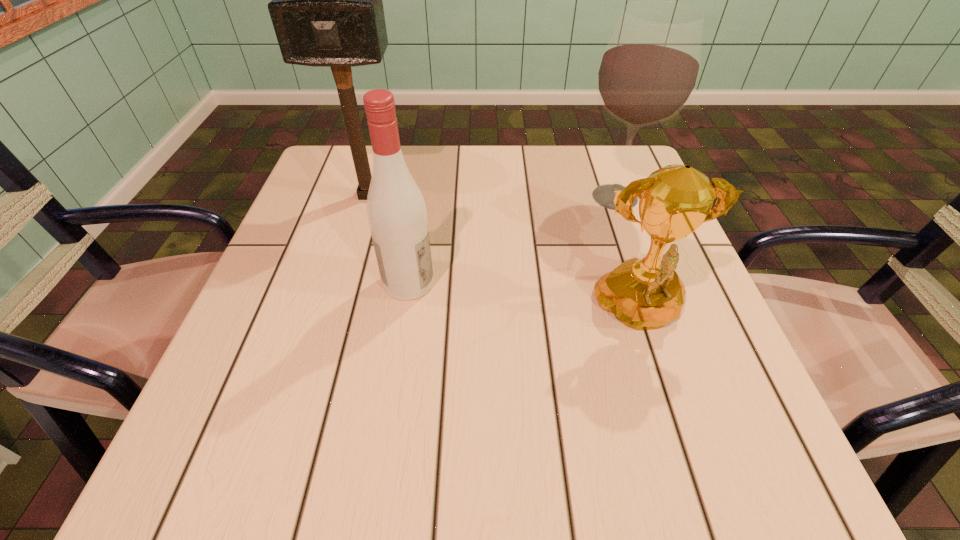
Find the location of a particular element. free space at the near left corner of the desktop is located at coordinates (225, 489).

You are a GUI agent. You are given a task and a screenshot of the screen. Output one action in this format:
    pyautogui.click(x=<x>, y=<y>)
    Task: Click on the blank space at the far right corner of the desktop
    
    Given the screenshot: What is the action you would take?
    pyautogui.click(x=597, y=153)

Identify the location of free spot between the shortest object and the left alcohol. (524, 299).

Identify the location of free space between the left alcohol and the shortest object. (524, 299).

Locate an element on the screen. Image resolution: width=960 pixels, height=540 pixels. free space between the shortest object and the farther alcohol is located at coordinates (628, 256).

You are a GUI agent. You are given a task and a screenshot of the screen. Output one action in this format:
    pyautogui.click(x=<x>, y=<y>)
    Task: Click on the free space between the right alcohol and the left alcohol
    
    Given the screenshot: What is the action you would take?
    pyautogui.click(x=512, y=240)

The height and width of the screenshot is (540, 960). I want to click on vacant area between the left alcohol and the right alcohol, so coord(512,240).

Locate an element on the screen. The image size is (960, 540). vacant area between the nearer alcohol and the farther alcohol is located at coordinates (512, 240).

The height and width of the screenshot is (540, 960). I want to click on vacant space in between the mallet and the award, so click(x=504, y=255).

This screenshot has height=540, width=960. I want to click on free space between the right alcohol and the mallet, so click(492, 196).